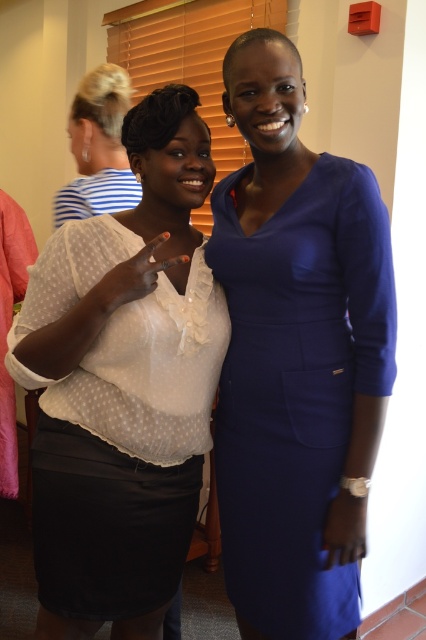
Which of these two, white dotted blouse at center or blonde hair at upper left, stands shorter?

Standing shorter between the two is blonde hair at upper left.

How distant is white dotted blouse at center from blonde hair at upper left?

They are 26.03 inches apart.

Who is more forward, (135, 445) or (120, 168)?

Point (135, 445) is in front.

You are a GUI agent. You are given a task and a screenshot of the screen. Output one action in this format:
    pyautogui.click(x=<x>, y=<y>)
    Task: Click on the white dotted blouse at center
    The width and height of the screenshot is (426, 640).
    Given the screenshot: What is the action you would take?
    pyautogui.click(x=123, y=385)

Between satin blue dress at center and blonde hair at upper left, which one has less height?

With less height is blonde hair at upper left.

Consider the image. Is satin blue dress at center bigger than blonde hair at upper left?

Correct, satin blue dress at center is larger in size than blonde hair at upper left.

Between point (230, 410) and point (100, 173), which one is positioned in front?

Point (230, 410) is more forward.

You are a GUI agent. You are given a task and a screenshot of the screen. Output one action in this format:
    pyautogui.click(x=<x>, y=<y>)
    Task: Click on the satin blue dress at center
    
    Given the screenshot: What is the action you would take?
    pyautogui.click(x=298, y=387)

This screenshot has height=640, width=426. I want to click on white dotted blouse at center, so click(x=123, y=385).

Consider the image. Who is lower down, white dotted blouse at center or satin blue dress at center?

satin blue dress at center is below.

Which is behind, point (157, 456) or point (267, 560)?

Point (267, 560)

At what (x,y) coordinates should I click in order to perform the action: click on white dotted blouse at center. Please return your answer as a coordinate pair (x, y). Looking at the image, I should click on (123, 385).